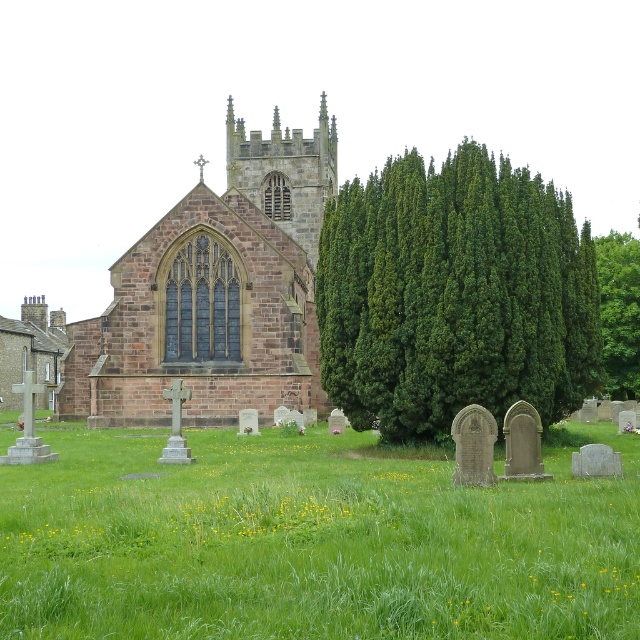
Can you confirm if green coniferous tree at center is positioned to the right of green leafy tree at upper right?

In fact, green coniferous tree at center is to the left of green leafy tree at upper right.

Can you confirm if green coniferous tree at center is positioned to the left of green leafy tree at upper right?

Yes, green coniferous tree at center is to the left of green leafy tree at upper right.

Which is behind, point (438, 406) or point (604, 371)?

Positioned behind is point (604, 371).

In order to click on green coniferous tree at center in this screenshot , I will do `click(454, 294)`.

Who is positioned more to the right, brown stone church at center or green leafy tree at upper right?

green leafy tree at upper right is more to the right.

Between brown stone church at center and green leafy tree at upper right, which one has less height?

With less height is green leafy tree at upper right.

This screenshot has width=640, height=640. What do you see at coordinates (216, 294) in the screenshot?
I see `brown stone church at center` at bounding box center [216, 294].

At what (x,y) coordinates should I click in order to perform the action: click on brown stone church at center. Please return your answer as a coordinate pair (x, y). The height and width of the screenshot is (640, 640). Looking at the image, I should click on (216, 294).

Is green grassy at center smaller than green leafy tree at upper right?

Indeed, green grassy at center has a smaller size compared to green leafy tree at upper right.

Is point (129, 604) less distant than point (611, 234)?

That is True.

Is point (408, 515) positioned behind point (625, 301)?

No, it is not.

Locate an element on the screen. The height and width of the screenshot is (640, 640). green grassy at center is located at coordinates (310, 541).